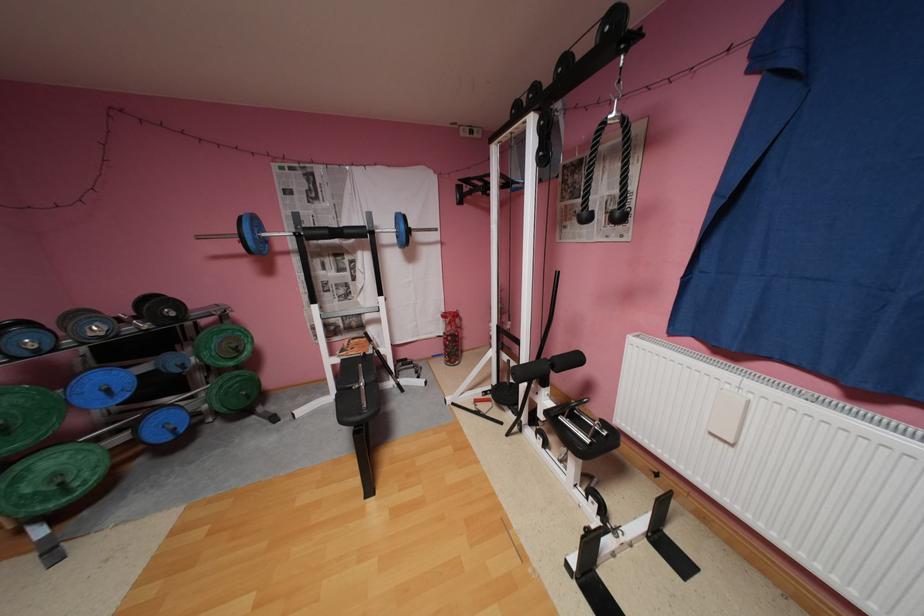
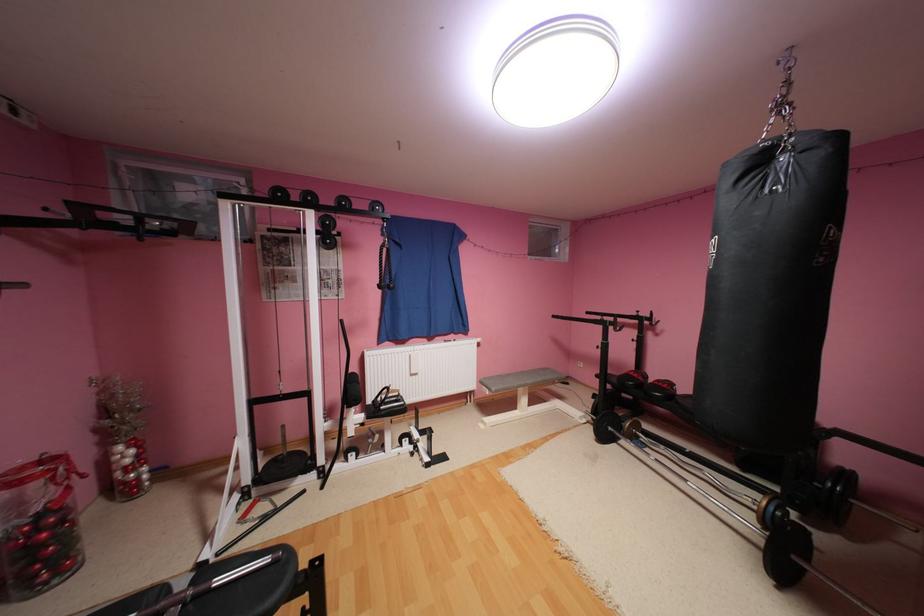
Locate, in the second image, the point that corresponds to (x=478, y=188) in the first image.

(78, 216)